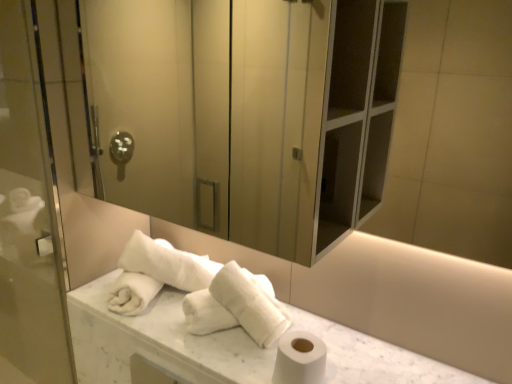
Image resolution: width=512 pixels, height=384 pixels. What are the coordinates of `free spot to the left of white fluffy towels at center, which appears as the first bath towel when viewed from the right` in the screenshot? It's located at (172, 327).